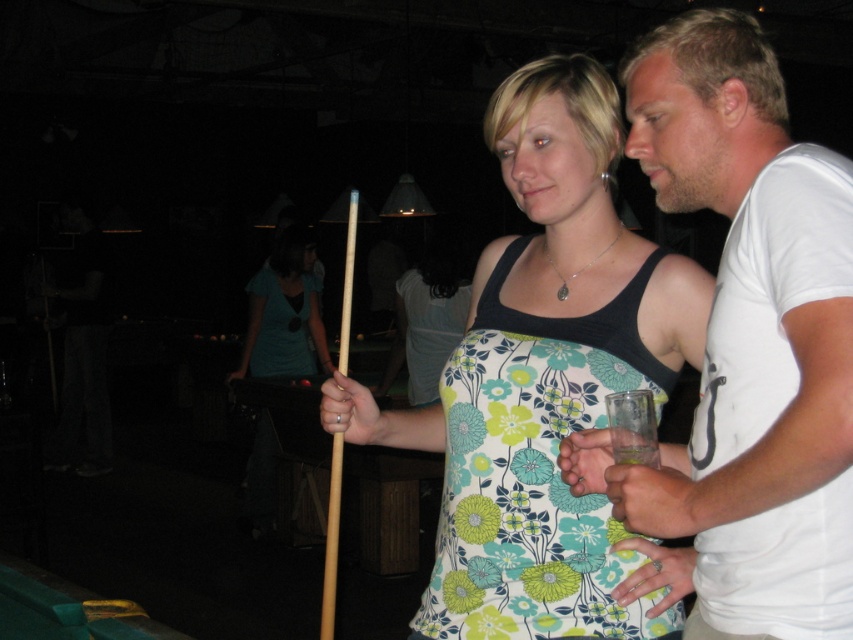
You are a photographer setting up a shoot in this scene. You need to place a backdrop that is 1.2 meters wide. The backdrop must be positioned between the floral fabric dress at center and the wooden cue at center. Can the backdrop fit between them without overlapping either object?

The floral fabric dress at center is wider than the wooden cue at center. Therefore, the backdrop measuring 1.2 meters can be placed between them as long as the combined width of both objects does not exceed the backdrop width. However, since the dress is wider, the total width might exceed 1.2 meters. Without exact measurements, it is uncertain. Please check the actual dimensions.